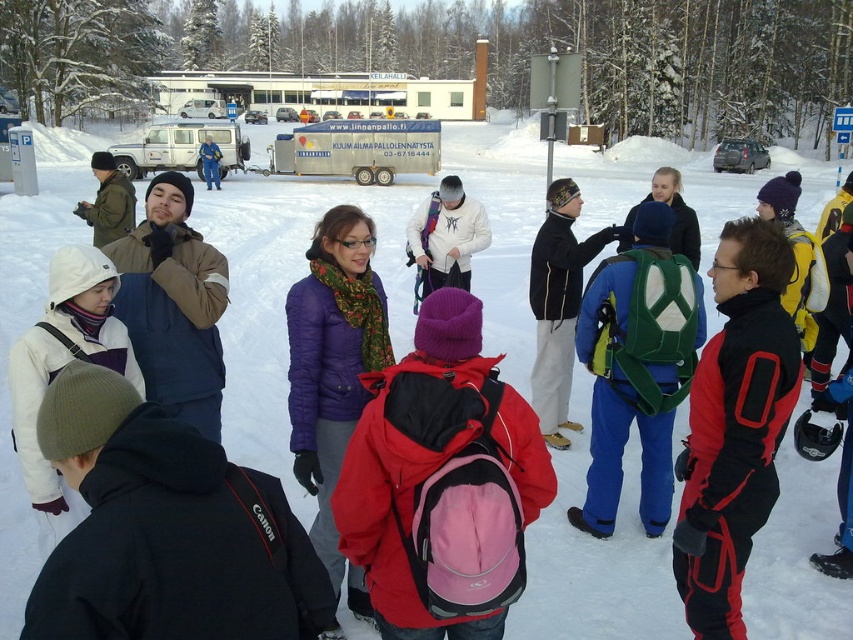
Which of these two, white fleece jacket at lower left or green fabric backpack at center, stands taller?

green fabric backpack at center is taller.

Which is more to the right, white fleece jacket at lower left or green fabric backpack at center?

green fabric backpack at center is more to the right.

Which is in front, point (76, 513) or point (554, 433)?

Point (76, 513) is in front.

Where is `white fleece jacket at lower left`? This screenshot has width=853, height=640. white fleece jacket at lower left is located at coordinates tap(61, 369).

Between brown fuzzy vest at left and white matte jacket at center, which one appears on the left side from the viewer's perspective?

From the viewer's perspective, brown fuzzy vest at left appears more on the left side.

Identify the location of brown fuzzy vest at left. (173, 305).

Who is more forward, (184, 192) or (408, 252)?

Point (184, 192) is more forward.

I want to click on brown fuzzy vest at left, so click(x=173, y=305).

Can you confirm if red synthetic jacket at center right is positioned below white matte van at upper left?

Yes, red synthetic jacket at center right is below white matte van at upper left.

Is point (764, 243) positioned behind point (165, 124)?

No, (764, 243) is in front of (165, 124).

The image size is (853, 640). What are the coordinates of `red synthetic jacket at center right` in the screenshot? It's located at (734, 426).